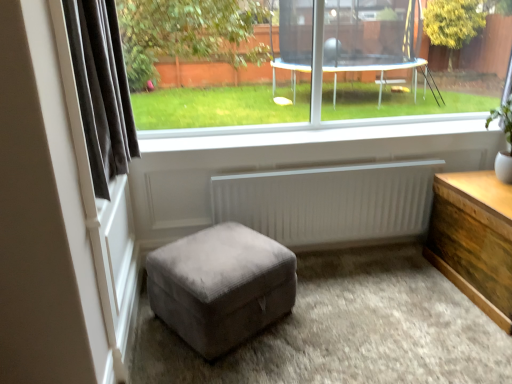
The width and height of the screenshot is (512, 384). I want to click on vacant area on top of white ribbed radiator at center (from a real-world perspective), so click(318, 171).